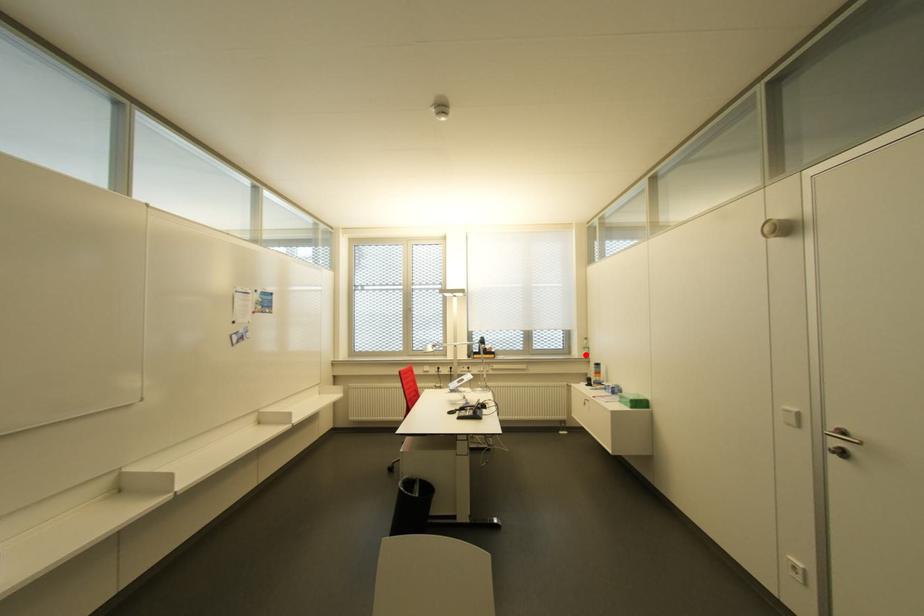
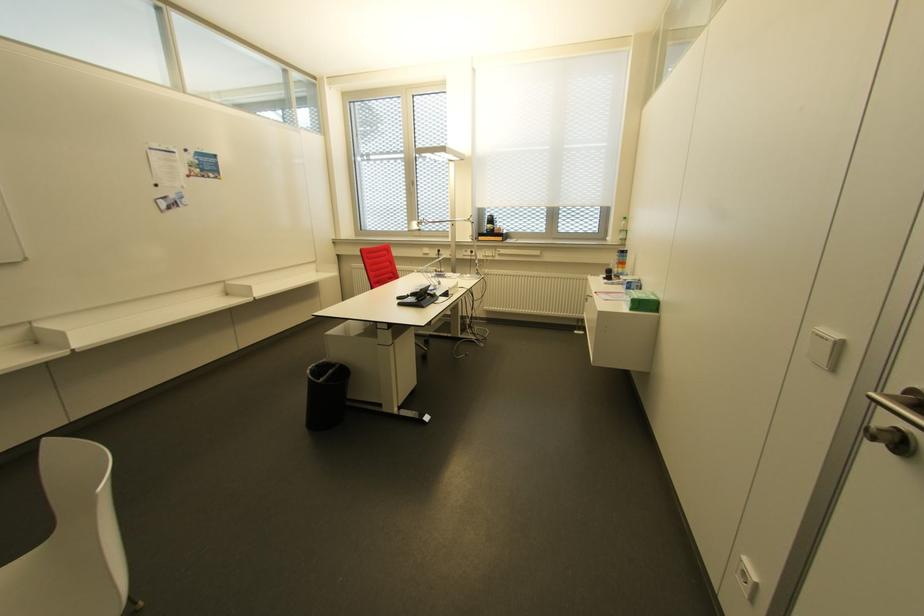
Question: I am providing you with two images of the same scene from different viewpoints. A red point is shown in image1. For the corresponding object point in image2, is it positioned nearer or farther from the camera?

Choices:
 (A) Nearer
 (B) Farther

Answer: (B)